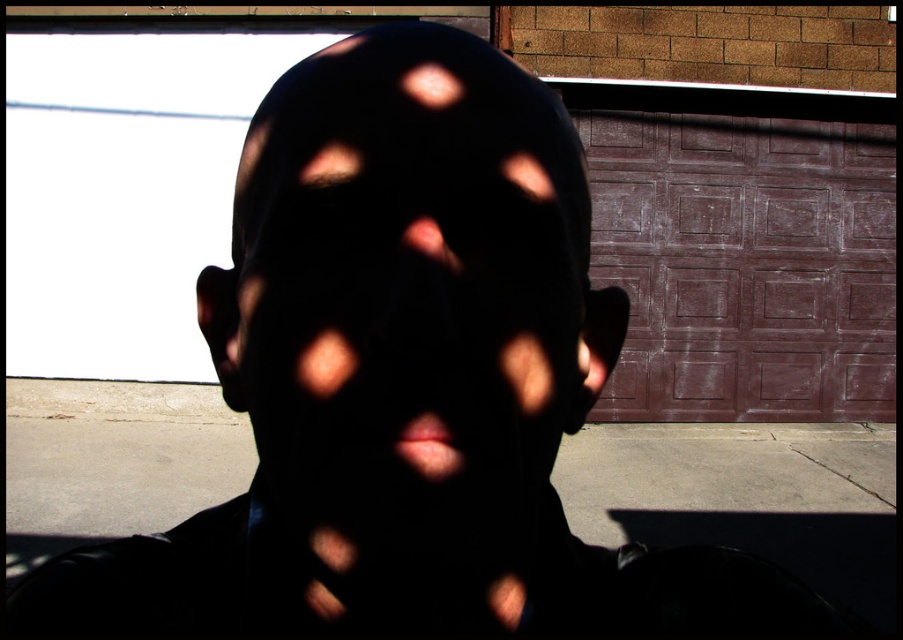
You are a photographer trying to capture a portrait. You have a camera with a 50mm lens and want to ensure the subject is in focus. The recommended focus distance for this lens is between 10 and 12 inches. Is the black matte face at center within the recommended focus distance?

The black matte face at center is 11.65 inches from camera, which falls within the recommended focus distance range of 10 to 12 inches. Therefore, the subject is within the recommended focus distance.

You are a security camera monitoring the garage. You see the black matte face at center and the brown textured garage door at center. Which object is closer to the camera?

The black matte face at center is closer to the camera because it is in front of the brown textured garage door at center.